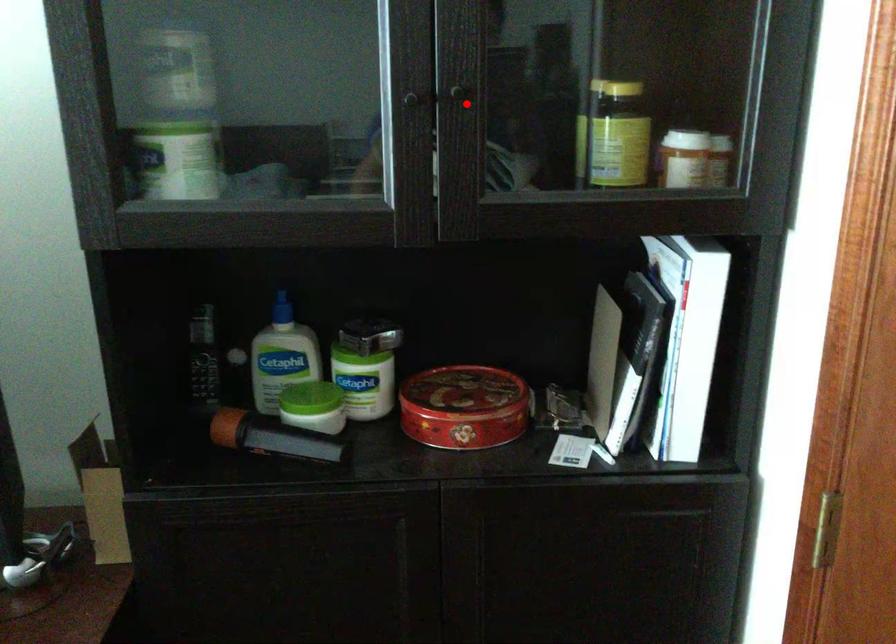
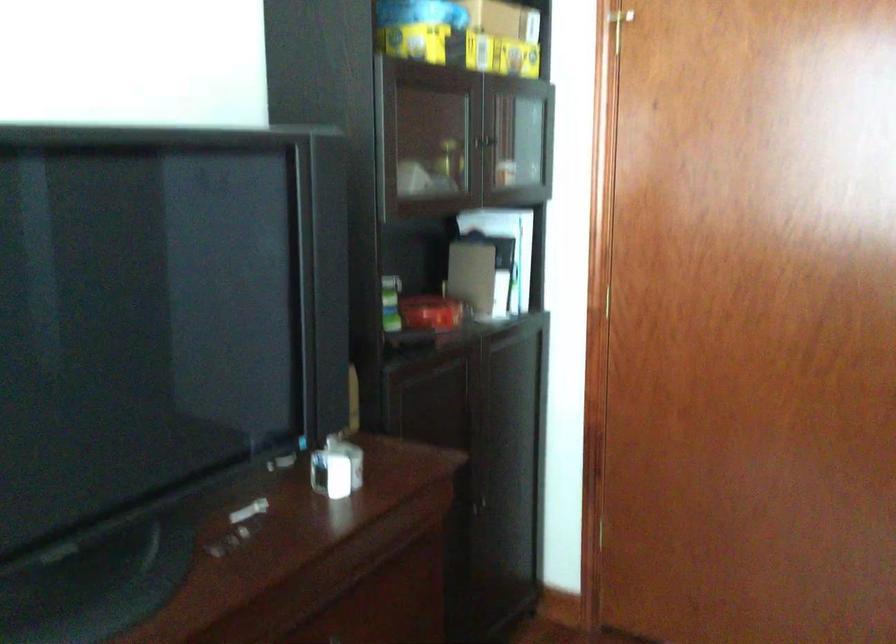
Locate, in the second image, the point that corresponds to the highlighted location in the first image.

(492, 140)